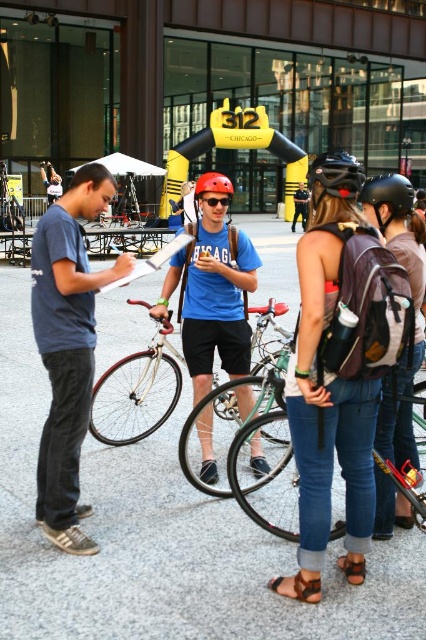
Question: Is denim jeans at center closer to camera compared to shiny red helmet at center?

Choices:
 (A) yes
 (B) no

Answer: (A)

Question: Among these points, which one is farthest from the camera?

Choices:
 (A) (281, 545)
 (B) (416, 304)

Answer: (A)

Question: Which of the following is the closest to the observer?

Choices:
 (A) (321, 563)
 (B) (11, 460)
 (C) (204, 184)

Answer: (A)

Question: From the image, what is the correct spatial relationship of white matte bicycle at center in relation to shiny red helmet at center?

Choices:
 (A) below
 (B) above

Answer: (A)

Question: Considering the relative positions of white matte bicycle at center and matte blue shirt at center in the image provided, where is white matte bicycle at center located with respect to matte blue shirt at center?

Choices:
 (A) below
 (B) above

Answer: (A)

Question: Which object is positioned closest to the matte black backpack at center?

Choices:
 (A) green matte bicycle at center
 (B) matte blue t-shirt at center
 (C) shiny red helmet at center
 (D) matte blue shirt at center

Answer: (B)